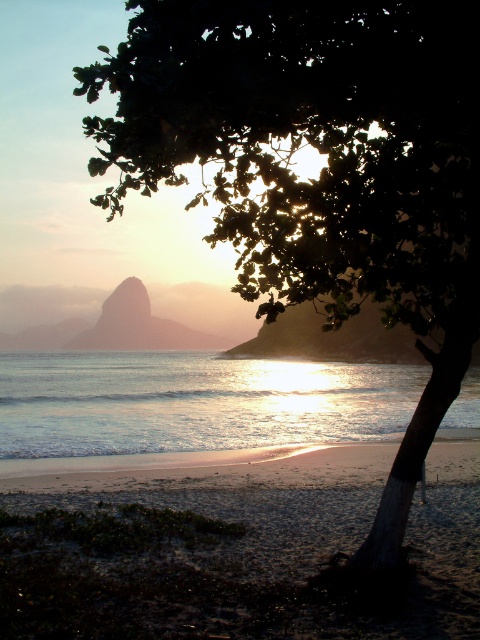
Which is above, sandy beach at lower left or shiny metallic water at center?

shiny metallic water at center

Does sandy beach at lower left have a larger size compared to shiny metallic water at center?

No, sandy beach at lower left is not bigger than shiny metallic water at center.

Locate an element on the screen. Image resolution: width=480 pixels, height=640 pixels. sandy beach at lower left is located at coordinates (230, 545).

Where is `sandy beach at lower left`? This screenshot has height=640, width=480. sandy beach at lower left is located at coordinates (230, 545).